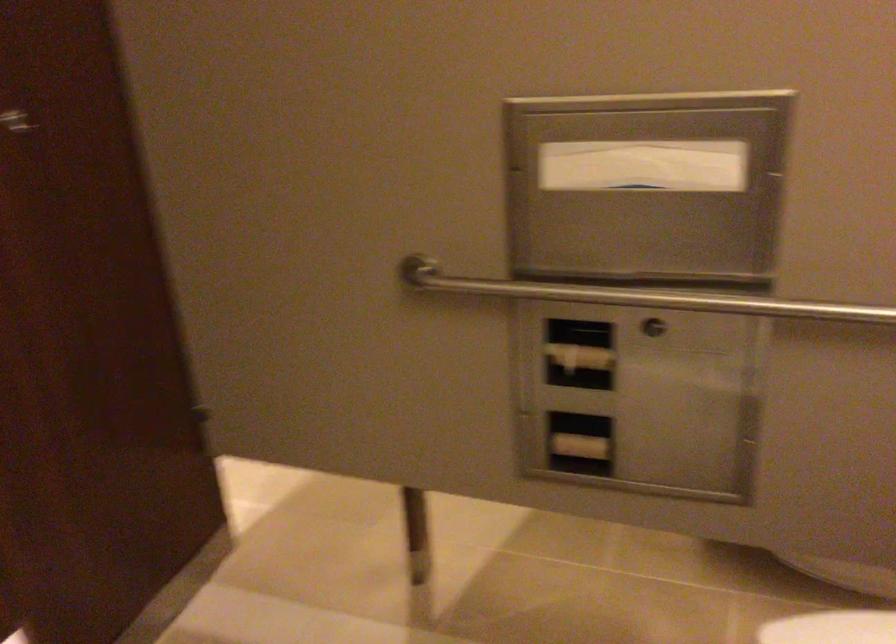
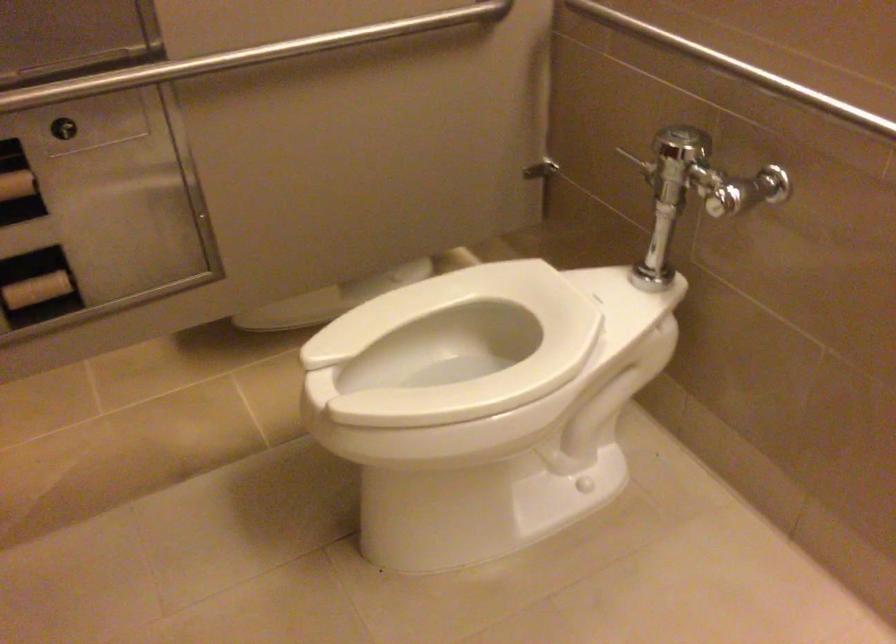
The first image is from the beginning of the video and the second image is from the end. How did the camera likely rotate when shooting the video?

The rotation direction of the camera is right-down.